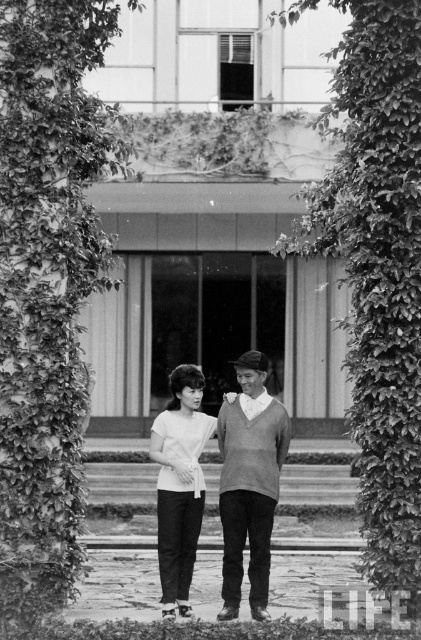
You are a photographer trying to capture a clear shot of the white matte shirt at center without the green leafy ivy at left blocking it. Based on their positions, is this possible?

The green leafy ivy at left is to the left of the white matte shirt at center, so the ivy is positioned to the left side of the shirt. Since they are not overlapping, the photographer can adjust the camera angle to frame the white matte shirt at center without the ivy obstructing the view.

You are a photographer standing in front of the building. You want to take a photo of the white matte shirt at center and the green leafy ivy at left. Can you fit both subjects into the frame without moving your position? Explain why or why not.

The green leafy ivy at left is 4.43 feet from the white matte shirt at center. Since the distance between them is only 4.43 feet, it is likely possible to capture both subjects in the frame without moving your position, provided the camera lens has an appropriate angle of view to encompass this distance.

You are standing in front of the building in the image. There is a point marked at coordinates (47, 285). What is located at this point?

The point at coordinates (47, 285) indicates green leafy ivy at left.